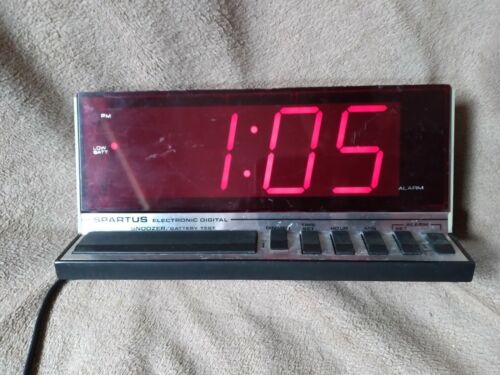
Where is `black alarm clock`? black alarm clock is located at coordinates (440, 160).